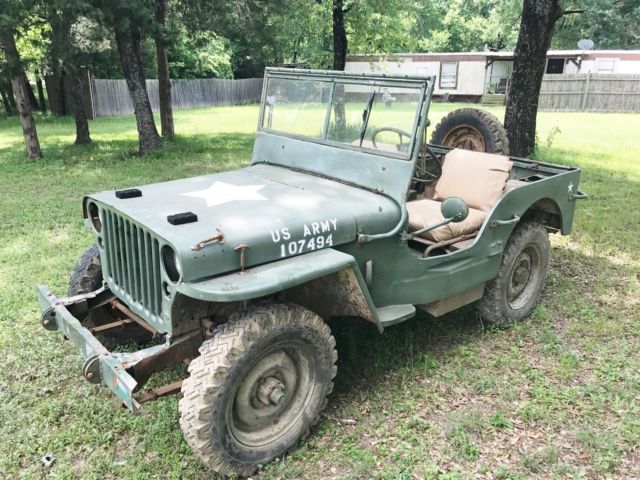
Identify the location of mirror. The image size is (640, 480). (450, 213).